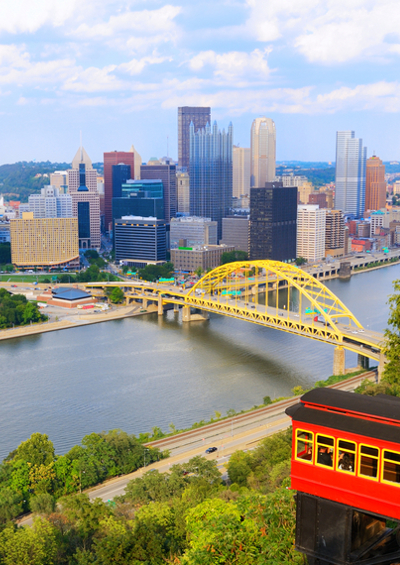
Image resolution: width=400 pixels, height=565 pixels. What are the coordinates of `yellow framed windows` in the screenshot? It's located at (299, 451), (323, 454), (345, 462), (367, 469), (390, 472), (392, 457), (373, 451), (349, 446), (322, 440), (302, 434).